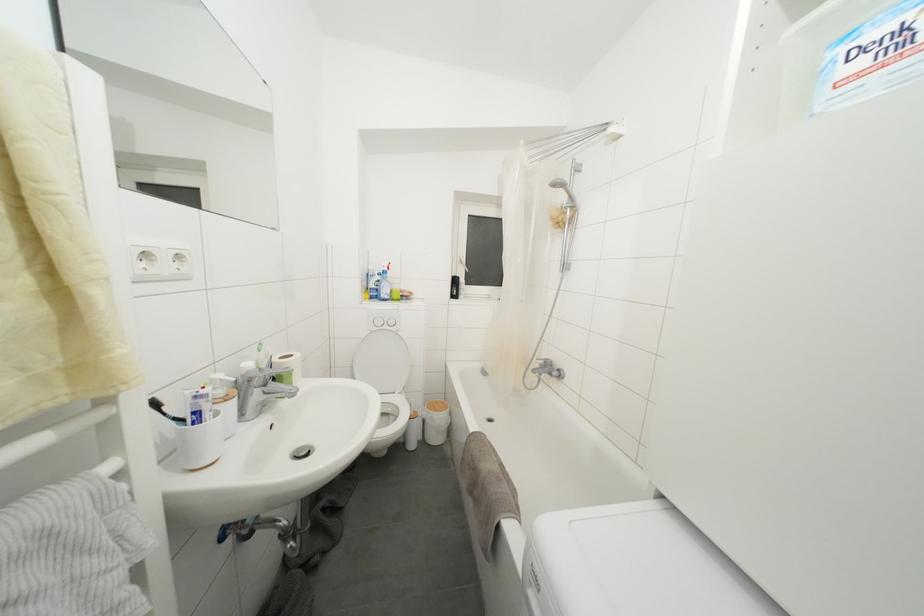
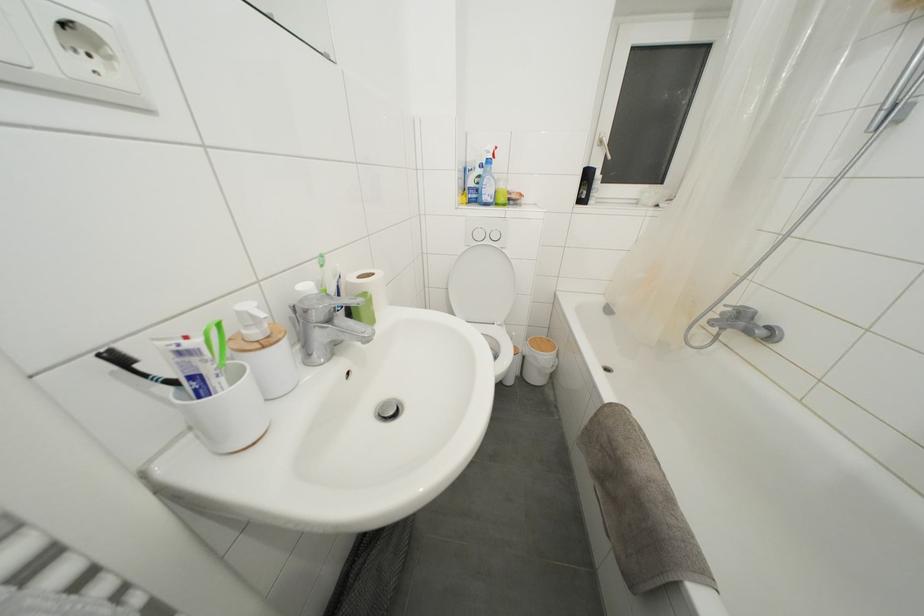
Find the pixel in the second image that matches (x=168, y=419) in the first image.

(150, 381)